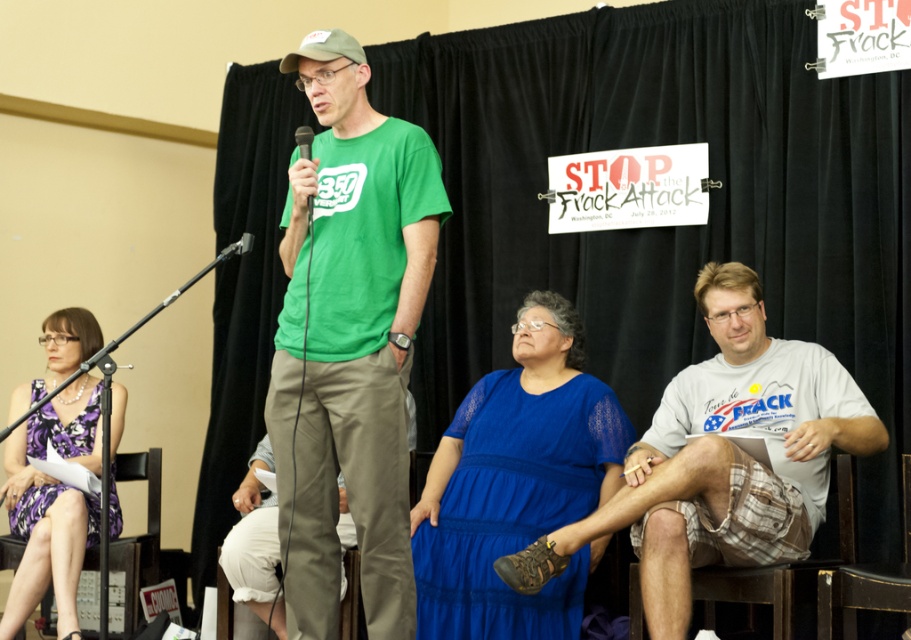
Question: Which object appears closest to the camera in this image?

Choices:
 (A) matte green microphone at center
 (B) white cotton t-shirt at center
 (C) purple satin dress at lower left
 (D) brown plaid shorts at lower right

Answer: (A)

Question: Can you confirm if brown plaid shorts at lower right is wider than matte green microphone at center?

Choices:
 (A) no
 (B) yes

Answer: (B)

Question: Which point is farther to the camera?

Choices:
 (A) (712, 625)
 (B) (62, 438)

Answer: (B)

Question: Can you confirm if blue lace dress at center is positioned to the right of purple satin dress at lower left?

Choices:
 (A) yes
 (B) no

Answer: (A)

Question: Can you confirm if white cotton t-shirt at center is positioned above black leather chair at lower right?

Choices:
 (A) yes
 (B) no

Answer: (A)

Question: Based on their relative distances, which object is nearer to the blue lace dress at center?

Choices:
 (A) white cotton t-shirt at center
 (B) black leather chair at lower right
 (C) matte green microphone at center
 (D) green matte t-shirt at center

Answer: (A)